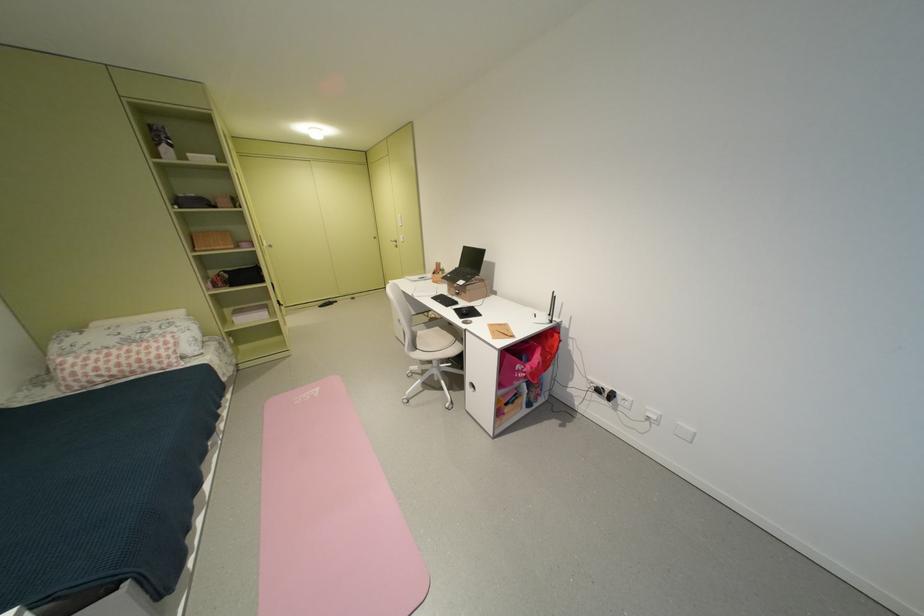
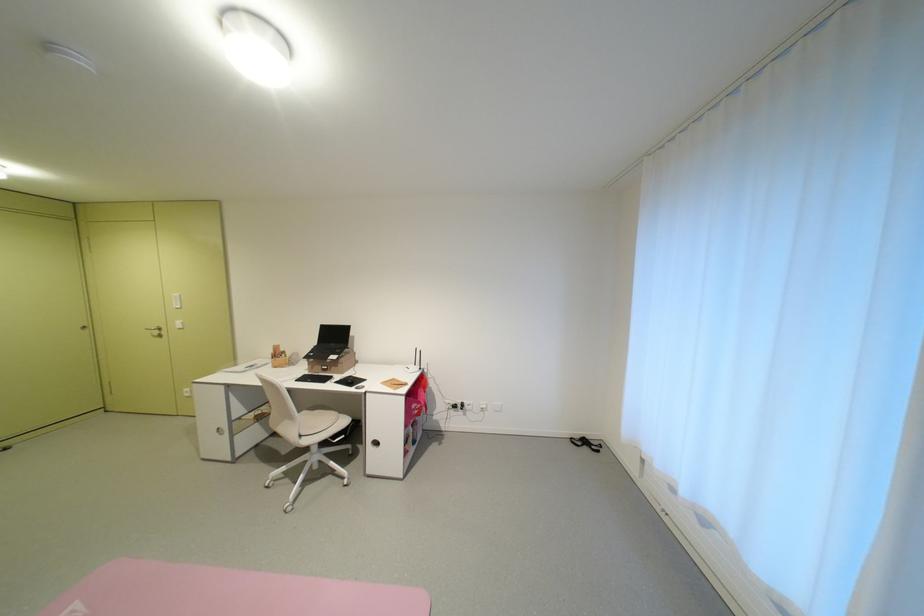
Question: Based on the continuous images, in which direction is the camera rotating? Reply with the corresponding letter.

Choices:
 (A) Left
 (B) Right
 (C) Up
 (D) Down

Answer: (B)